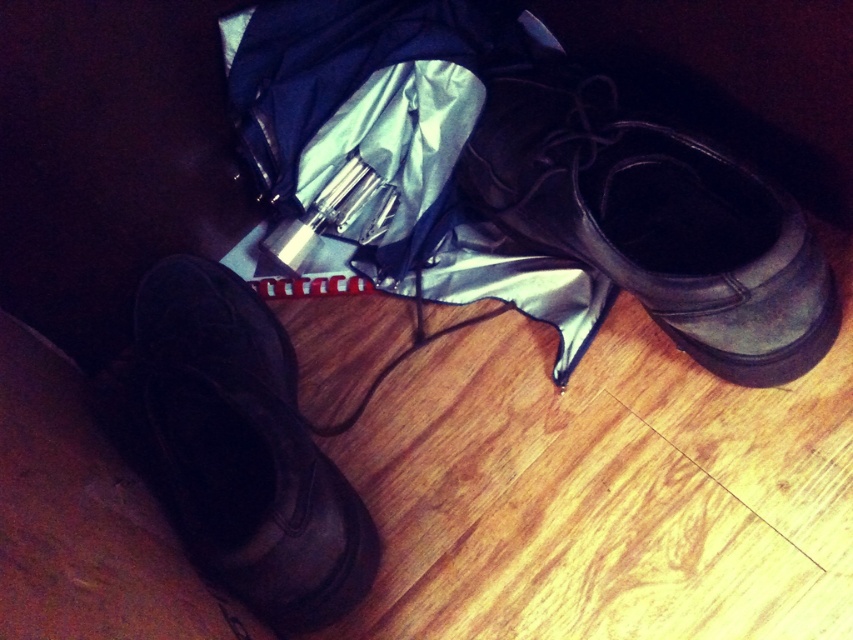
What do you see at coordinates (392, 150) in the screenshot? This screenshot has height=640, width=853. I see `silvery fabric umbrella at center` at bounding box center [392, 150].

I want to click on silvery fabric umbrella at center, so click(x=392, y=150).

You are a GUI agent. You are given a task and a screenshot of the screen. Output one action in this format:
    pyautogui.click(x=<x>, y=<y>)
    Task: Click on the silvery fabric umbrella at center
    The height and width of the screenshot is (640, 853).
    Given the screenshot: What is the action you would take?
    point(392,150)

Is silvery fabric umbrella at center wider than leather boot at center?

Yes.

Is point (589, 323) closer to viewer compared to point (786, 196)?

No, it is not.

Image resolution: width=853 pixels, height=640 pixels. What are the coordinates of `silvery fabric umbrella at center` in the screenshot? It's located at (392, 150).

Who is positioned more to the left, leather boot at center or matte black boot at lower left?

matte black boot at lower left

In the scene shown: Who is taller, leather boot at center or matte black boot at lower left?

With more height is matte black boot at lower left.

Is point (659, 228) positioned behind point (115, 387)?

No, it is not.

The height and width of the screenshot is (640, 853). Find the location of `leather boot at center`. leather boot at center is located at coordinates (654, 220).